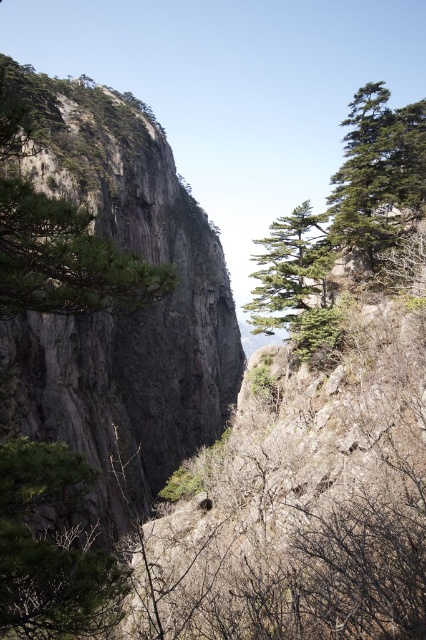
You are a hiker trying to navigate between two green matte trees in a mountainous area. The green matte tree at lower left and the green matte tree at upper right are your landmarks. Which tree would you choose to aim for if you want to reach a wider tree for shade?

The green matte tree at upper right has a greater width than the green matte tree at lower left, so you should aim for the green matte tree at upper right to find a wider tree for shade.

You are a hiker planning to climb the green rough rock at upper left and the green matte tree at upper right. Which one do you think is taller?

The green rough rock at upper left is much taller than the green matte tree at upper right, so the rock is taller.

You are a hiker standing at the base of the mountain looking up. You see two points marked on the cliffs. The first point is at coordinate point (123,262) and the second is at point (340,180). Which point is closer to you?

Point (123,262) is in front of point (340,180), so the first point is closer to you.